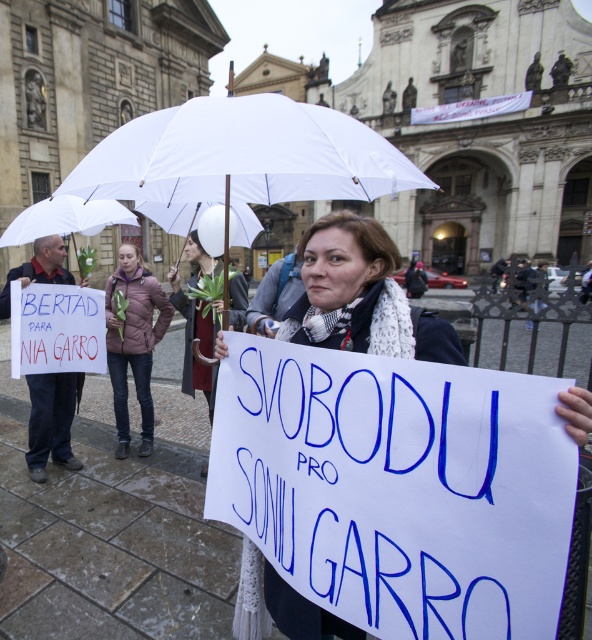
You are a photographer trying to capture a closeup of the white paper sign at center and the purple down jacket at center in the protest scene. Given that your camera can only focus on objects wider than 20cm, can both objects be in focus?

The white paper sign at center has a width less than the purple down jacket at center. Since the purple down jacket at center is wider than 20cm, it can be in focus. However, the white paper sign at center is narrower than the jacket, so its width might be under 20cm and may not be in focus.

You are a photographer trying to capture the protestor holding the white paper sign at center and the purple down jacket at center in a single frame. Which object should you focus on first to ensure both are in the frame without cropping?

You should focus on the white paper sign at center first since it is smaller in size compared to the purple down jacket at center, ensuring it fits within the frame while capturing both objects.

Based on the scene description, can you determine the spatial relationship between the purple down jacket at center and the white matte umbrella at upper center?

The purple down jacket at center is located to the right of the white matte umbrella at upper center.